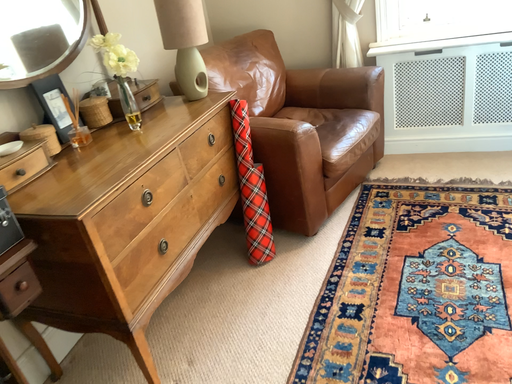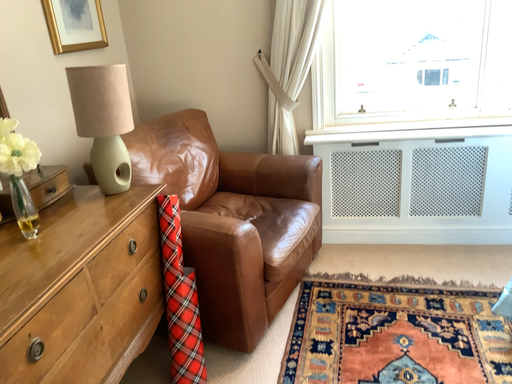
Question: How did the camera likely rotate when shooting the video?

Choices:
 (A) rotated left
 (B) rotated right

Answer: (B)